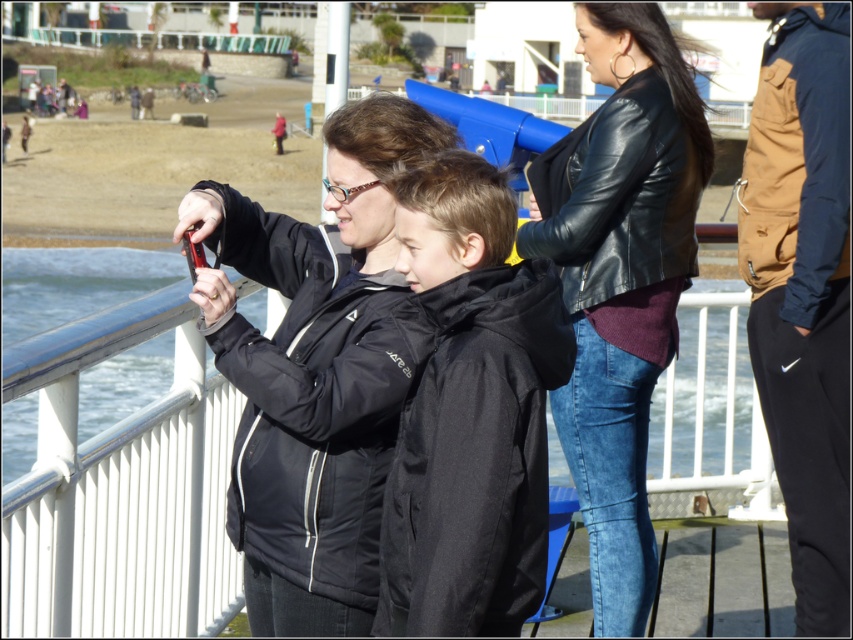
Question: Which point is closer to the camera?

Choices:
 (A) black matte jacket at center
 (B) black leather jacket at center
 (C) brown suede jacket at upper right
 (D) matte black jacket at center

Answer: (A)

Question: Among these points, which one is nearest to the camera?

Choices:
 (A) (379, 259)
 (B) (592, 460)

Answer: (A)

Question: Does matte black jacket at center appear over black matte jacket at center?

Choices:
 (A) yes
 (B) no

Answer: (A)

Question: Can you confirm if black leather jacket at center is positioned below brown suede jacket at upper right?

Choices:
 (A) no
 (B) yes

Answer: (B)

Question: Is black matte jacket at center further to camera compared to brown suede jacket at upper right?

Choices:
 (A) yes
 (B) no

Answer: (B)

Question: Which point is farther to the camera?

Choices:
 (A) brown suede jacket at upper right
 (B) matte black jacket at center
 (C) black matte jacket at center
 (D) black leather jacket at center

Answer: (D)